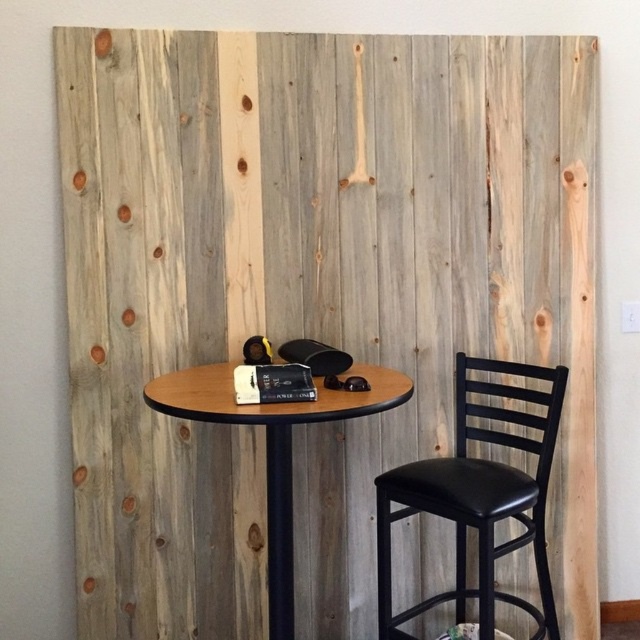
You are sitting at the wooden round table at center and want to reach the black leather chair at right. In which direction should you move to get there?

You should move to the right direction from the wooden round table at center to reach the black leather chair at right, as it is positioned to the right of the table.